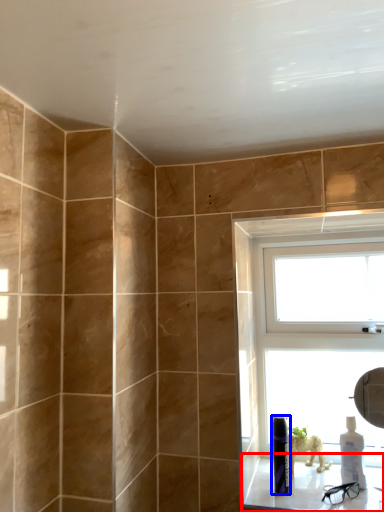
Question: Which object appears closest to the camera in this image, window sill (highlighted by a red box) or toiletry (highlighted by a blue box)?

Choices:
 (A) window sill
 (B) toiletry

Answer: (A)